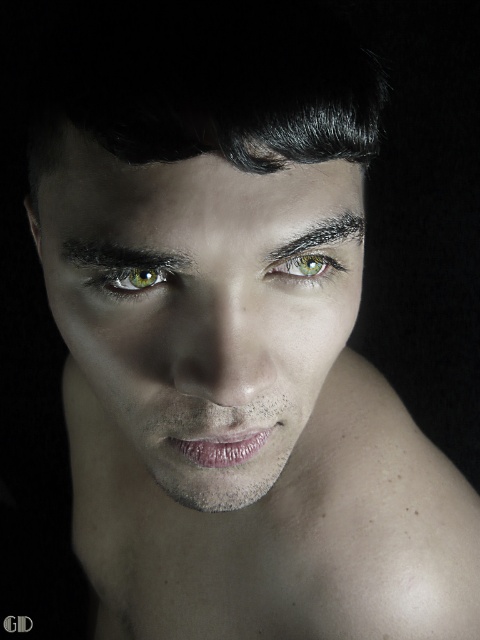
Question: Does green matte eye at upper center appear over green matte eye at center?

Choices:
 (A) yes
 (B) no

Answer: (B)

Question: Can you confirm if green matte eye at upper center is positioned below green matte eye at center?

Choices:
 (A) no
 (B) yes

Answer: (B)

Question: Which point appears closest to the camera in this image?

Choices:
 (A) (68, 145)
 (B) (326, 268)

Answer: (A)

Question: Which of these objects is positioned farthest from the smooth skin at lower center?

Choices:
 (A) green matte eye at upper center
 (B) smooth skin face at center

Answer: (A)

Question: Considering the relative positions of green matte eye at upper center and green matte eye at center in the image provided, where is green matte eye at upper center located with respect to green matte eye at center?

Choices:
 (A) left
 (B) right

Answer: (A)

Question: Which point is farther from the camera taking this photo?

Choices:
 (A) (144, 282)
 (B) (194, 634)

Answer: (B)